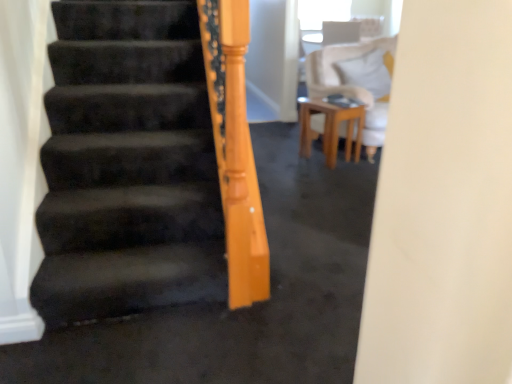
Image resolution: width=512 pixels, height=384 pixels. What are the coordinates of `vacant region to the left of wooden table at center` in the screenshot? It's located at (279, 157).